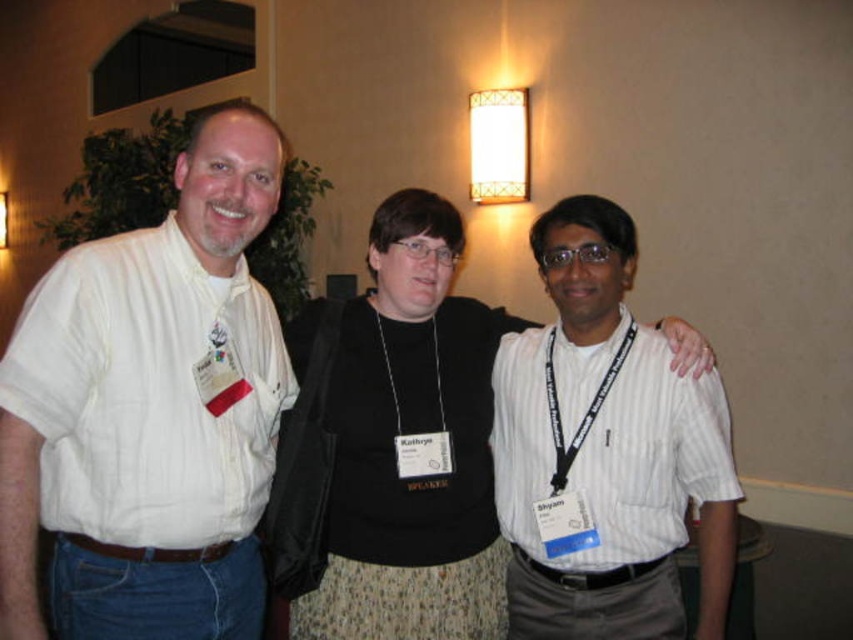
Question: Is black fabric at center to the left of white striped shirt at center from the viewer's perspective?

Choices:
 (A) yes
 (B) no

Answer: (A)

Question: Which of the following is the closest to the observer?

Choices:
 (A) white striped shirt at center
 (B) white striped shirt at left
 (C) black fabric at center

Answer: (B)

Question: Among these points, which one is farthest from the camera?

Choices:
 (A) (453, 360)
 (B) (77, 492)

Answer: (A)

Question: Which object is farther from the camera taking this photo?

Choices:
 (A) white striped shirt at left
 (B) white striped shirt at center
 (C) black fabric at center

Answer: (C)

Question: Is white striped shirt at left to the right of white striped shirt at center from the viewer's perspective?

Choices:
 (A) no
 (B) yes

Answer: (A)

Question: Where is white striped shirt at left located in relation to black fabric at center in the image?

Choices:
 (A) below
 (B) above

Answer: (B)